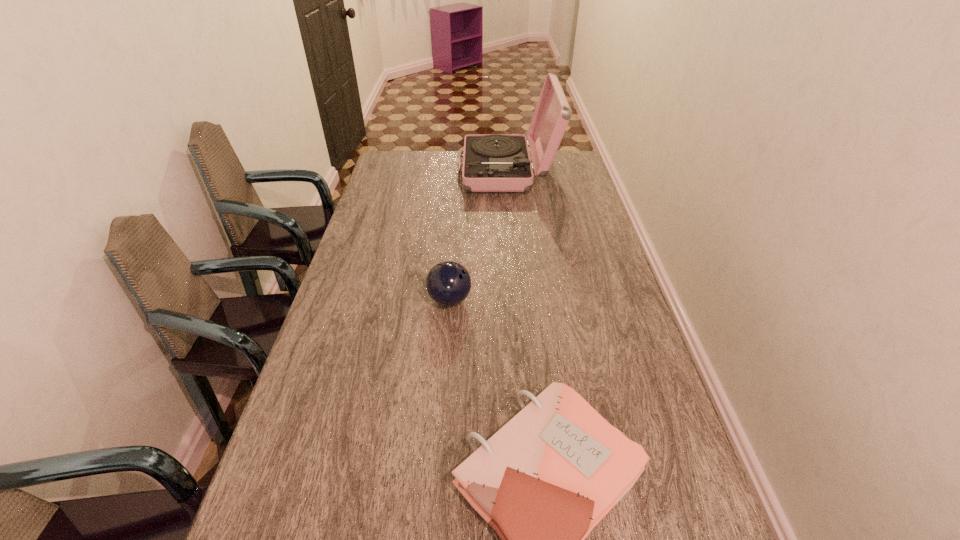
You are a GUI agent. You are given a task and a screenshot of the screen. Output one action in this format:
    pyautogui.click(x=<x>, y=<y>)
    Task: Click on the tallest object
    This screenshot has height=540, width=960.
    Given the screenshot: What is the action you would take?
    pyautogui.click(x=491, y=162)

At what (x,y) coordinates should I click in order to perform the action: click on record player. Please return your answer as a coordinate pair (x, y). The height and width of the screenshot is (540, 960). Looking at the image, I should click on (491, 162).

Locate an element on the screen. The width and height of the screenshot is (960, 540). the second tallest object is located at coordinates (448, 283).

Locate an element on the screen. bowling ball is located at coordinates (448, 283).

This screenshot has width=960, height=540. I want to click on vacant space located with the lid open on the tallest object, so click(428, 172).

Locate an element on the screen. The height and width of the screenshot is (540, 960). vacant space situated with the lid open on the tallest object is located at coordinates (433, 172).

What are the coordinates of `vacant space located 0.240m with the lid open on the tallest object` in the screenshot? It's located at (403, 172).

In order to click on vacant space located on the surface of the second shortest object near the finger holes in this screenshot , I will do `click(578, 300)`.

The height and width of the screenshot is (540, 960). Find the location of `object located in the far edge section of the desktop`. object located in the far edge section of the desktop is located at coordinates pyautogui.click(x=491, y=162).

The image size is (960, 540). I want to click on object present at the right edge, so click(x=491, y=162).